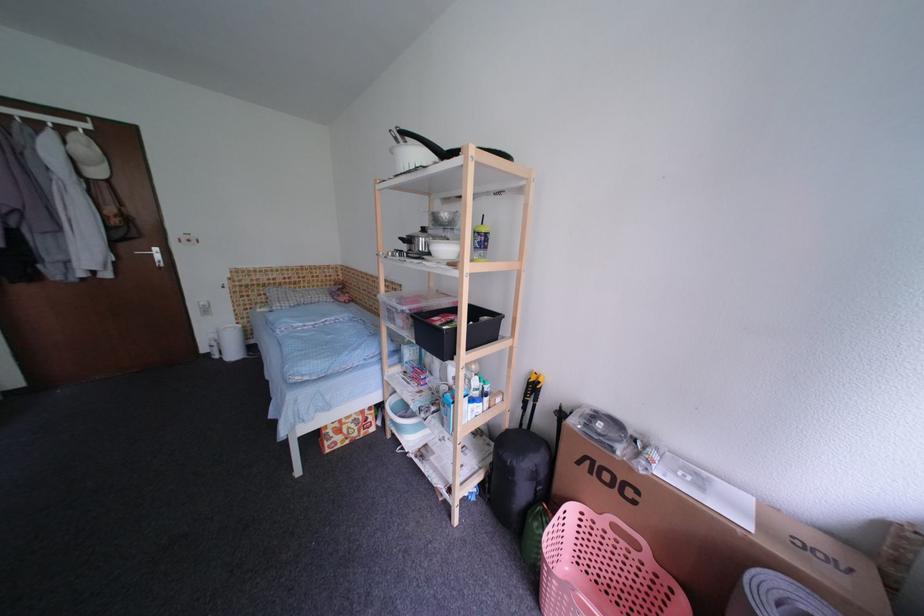
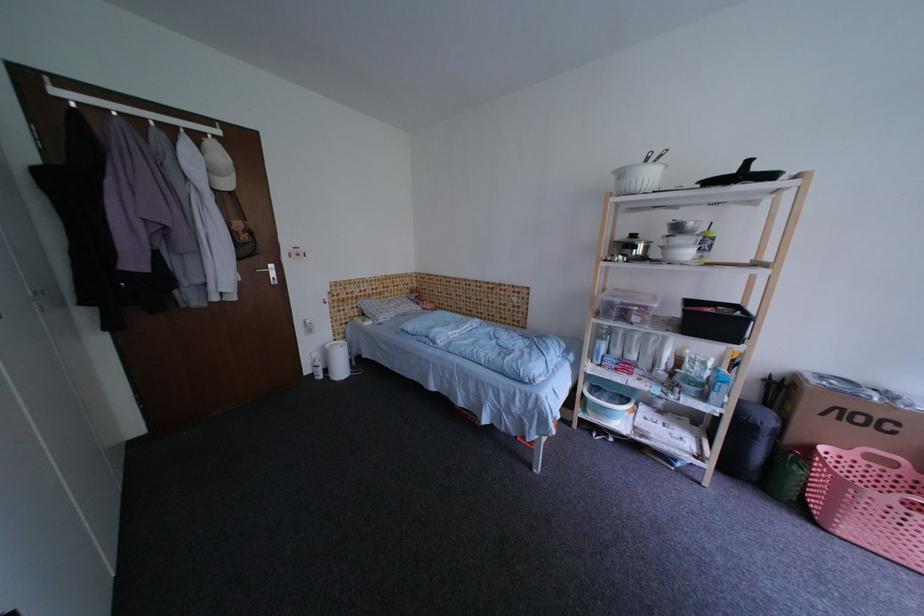
Locate, in the second image, the point that corresponds to (213,352) in the first image.

(314, 374)